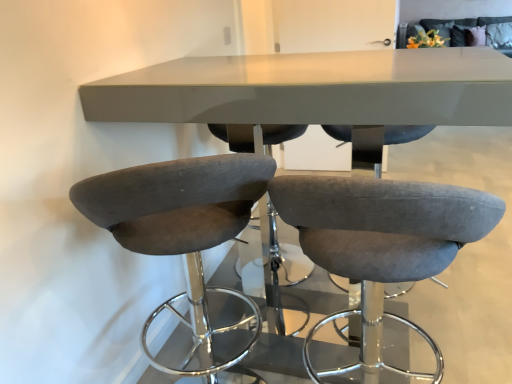
Question: Is matte gray table at center positioned with its back to suede-like gray bar stool at left, which is the second chair from right to left?

Choices:
 (A) yes
 (B) no

Answer: (B)

Question: Is matte gray table at center thinner than suede-like gray bar stool at left, which appears as the first chair when viewed from the left?

Choices:
 (A) no
 (B) yes

Answer: (A)

Question: Can you confirm if matte gray table at center is smaller than suede-like gray bar stool at left, which is the second chair from right to left?

Choices:
 (A) yes
 (B) no

Answer: (B)

Question: Is matte gray table at center at the left side of suede-like gray bar stool at left, which appears as the first chair when viewed from the left?

Choices:
 (A) no
 (B) yes

Answer: (A)

Question: Is matte gray table at center taller than suede-like gray bar stool at left, which appears as the first chair when viewed from the left?

Choices:
 (A) no
 (B) yes

Answer: (B)

Question: Considering the positions of matte gray table at center and suede gray bar stool at center, the 2th chair from the left, in the image, is matte gray table at center bigger or smaller than suede gray bar stool at center, the 2th chair from the left,?

Choices:
 (A) small
 (B) big

Answer: (B)

Question: Is point (425, 102) positioned closer to the camera than point (287, 187)?

Choices:
 (A) closer
 (B) farther

Answer: (B)

Question: Looking at their shapes, would you say matte gray table at center is wider or thinner than suede gray bar stool at center, the 2th chair from the left?

Choices:
 (A) thin
 (B) wide

Answer: (B)

Question: Which is correct: matte gray table at center is inside suede gray bar stool at center, the 1th chair viewed from the right, or outside of it?

Choices:
 (A) outside
 (B) inside

Answer: (A)

Question: From their relative heights in the image, would you say suede gray bar stool at center, the 1th chair viewed from the right, is taller or shorter than suede-like gray bar stool at left, which appears as the first chair when viewed from the left?

Choices:
 (A) short
 (B) tall

Answer: (A)

Question: Considering the positions of suede gray bar stool at center, the 1th chair viewed from the right, and suede-like gray bar stool at left, which is the second chair from right to left, in the image, is suede gray bar stool at center, the 1th chair viewed from the right, wider or thinner than suede-like gray bar stool at left, which is the second chair from right to left,?

Choices:
 (A) thin
 (B) wide

Answer: (A)

Question: Considering their positions, is suede gray bar stool at center, the 1th chair viewed from the right, located in front of or behind suede-like gray bar stool at left, which appears as the first chair when viewed from the left?

Choices:
 (A) front
 (B) behind

Answer: (A)

Question: Is suede gray bar stool at center, the 2th chair from the left, spatially inside suede-like gray bar stool at left, which appears as the first chair when viewed from the left, or outside of it?

Choices:
 (A) outside
 (B) inside

Answer: (A)

Question: Is point (489, 117) positioned closer to the camera than point (174, 246)?

Choices:
 (A) closer
 (B) farther

Answer: (A)

Question: Choose the correct answer: Is matte gray table at center inside suede-like gray bar stool at left, which is the second chair from right to left, or outside it?

Choices:
 (A) outside
 (B) inside

Answer: (A)